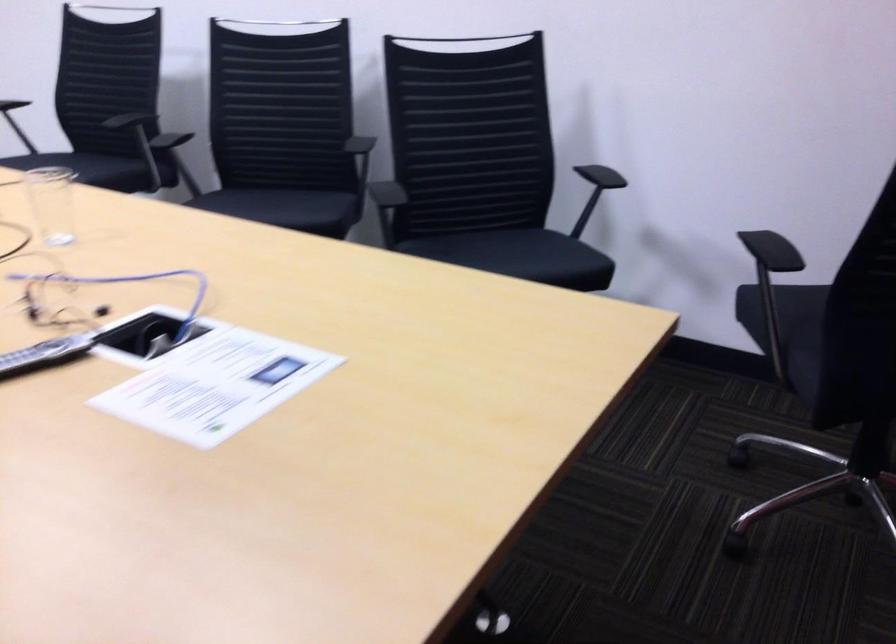
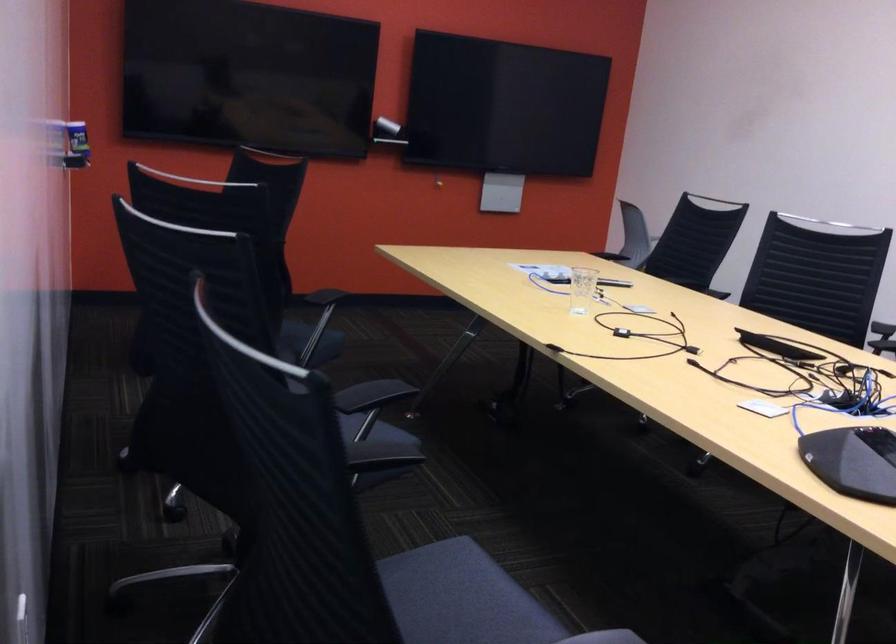
Find the pixel in the second image that matches point (202, 203) in the first image.

(374, 430)